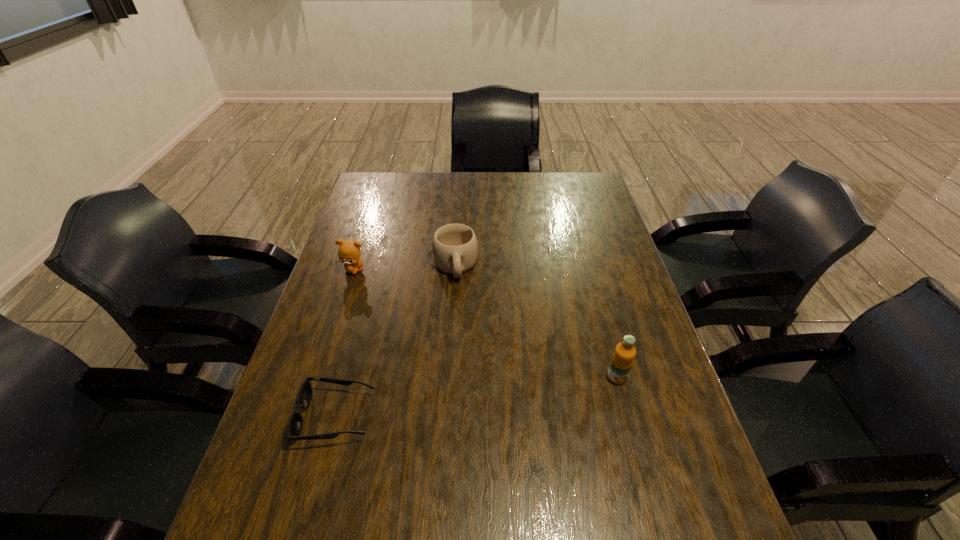
The width and height of the screenshot is (960, 540). What are the coordinates of `the nearest object` in the screenshot? It's located at (304, 398).

Where is `the shortest object`? The width and height of the screenshot is (960, 540). the shortest object is located at coordinates [x=304, y=398].

Locate an element on the screen. The image size is (960, 540). the second nearest object is located at coordinates (622, 360).

You are a GUI agent. You are given a task and a screenshot of the screen. Output one action in this format:
    pyautogui.click(x=<x>, y=<y>)
    Task: Click on the orange juice
    
    Given the screenshot: What is the action you would take?
    pyautogui.click(x=622, y=360)

At what (x,y) coordinates should I click in order to perform the action: click on the third object from left to right. Please return your answer as a coordinate pair (x, y). This screenshot has height=540, width=960. Looking at the image, I should click on (454, 246).

This screenshot has height=540, width=960. In order to click on teddy bear in this screenshot , I will do `click(349, 251)`.

Find the location of a particular element. The height and width of the screenshot is (540, 960). free space located on the label of the rightmost object is located at coordinates (642, 469).

You are a GUI agent. You are given a task and a screenshot of the screen. Output one action in this format:
    pyautogui.click(x=<x>, y=<y>)
    Task: Click on the vacant area situated 0.200m on the side of the mug with the handle
    This screenshot has height=540, width=960.
    Given the screenshot: What is the action you would take?
    pyautogui.click(x=463, y=337)

What are the coordinates of `vacant area located 0.320m on the side of the mug with the handle` in the screenshot? It's located at (467, 375).

Identify the location of vacant region located on the side of the mug with the handle. (467, 375).